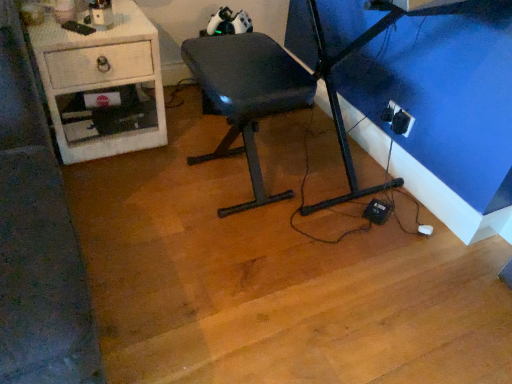
The image size is (512, 384). Find the location of `empty space that is to the right of white glossy desk at left`. empty space that is to the right of white glossy desk at left is located at coordinates (x=183, y=137).